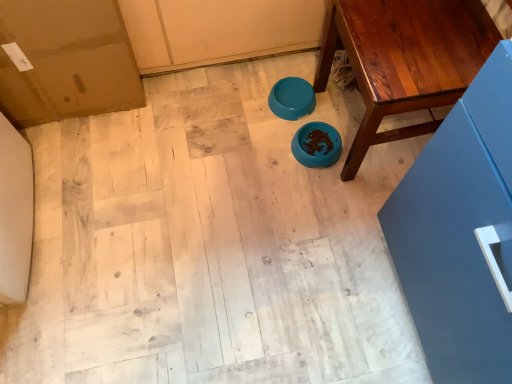
In order to click on vacant region to the right of teal glossy bowl at center, which appears as the second bowl when ordered from the bottom in this screenshot , I will do `click(333, 102)`.